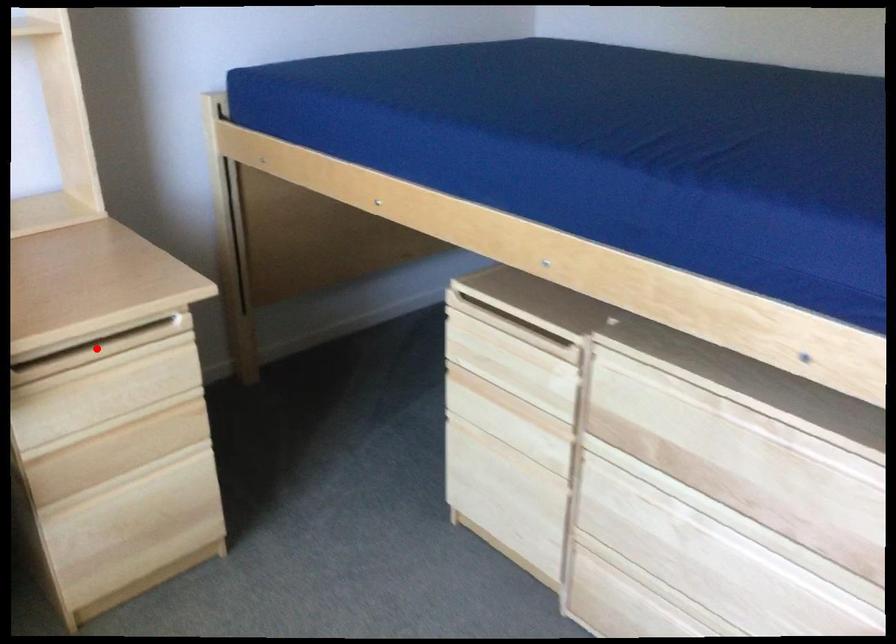
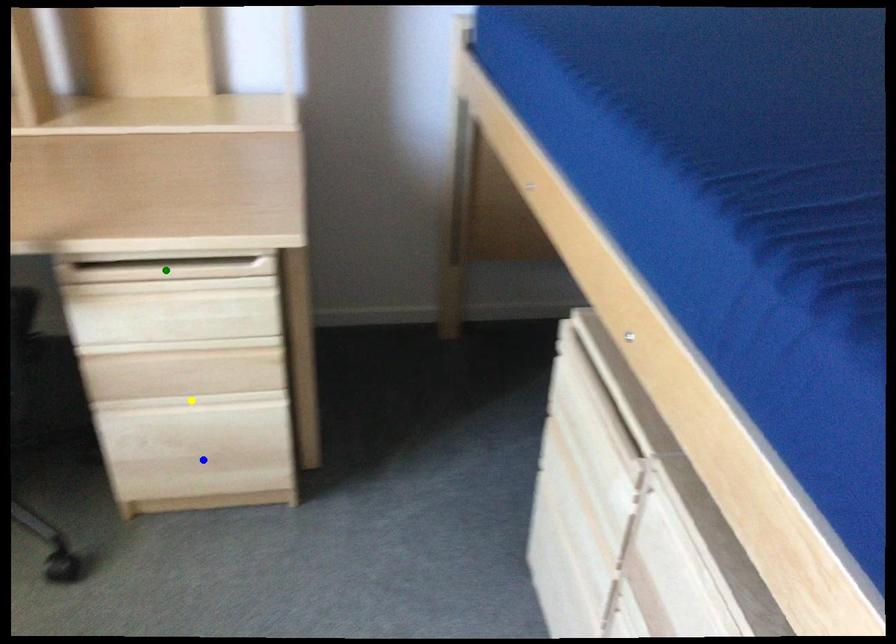
Question: I am providing you with two images of the same scene from different viewpoints. A red point is marked on the first image. You are given multiple points on the second image. Which point in image 2 is actually the same real-world point as the red point in image 1?

Choices:
 (A) yellow point
 (B) blue point
 (C) green point

Answer: (C)